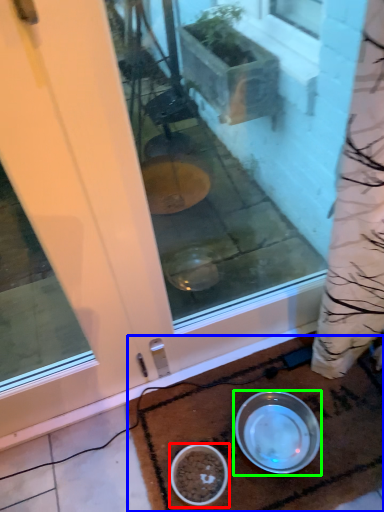
Question: Considering the real-world distances, which object is farthest from bowl (highlighted by a red box)? doormat (highlighted by a blue box) or bowl (highlighted by a green box)?

Choices:
 (A) doormat
 (B) bowl

Answer: (A)